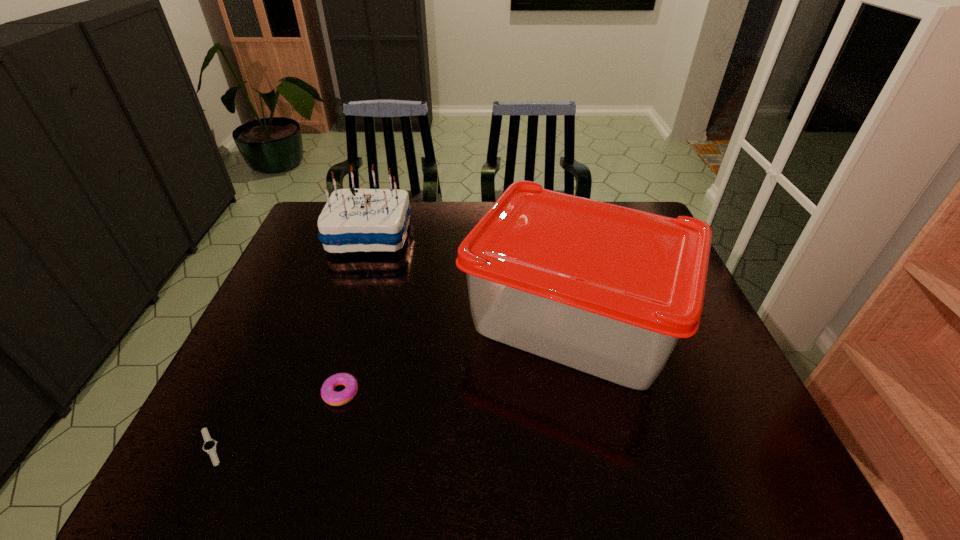
At what (x,y) coordinates should I click in order to perform the action: click on the rightmost object. Please return your answer as a coordinate pair (x, y). The height and width of the screenshot is (540, 960). Looking at the image, I should click on (608, 290).

I want to click on tray, so click(x=608, y=290).

Image resolution: width=960 pixels, height=540 pixels. Identify the location of the second tallest object. (353, 220).

You are a GUI agent. You are given a task and a screenshot of the screen. Output one action in this format:
    pyautogui.click(x=<x>, y=<y>)
    Task: Click on the doughnut
    This screenshot has width=960, height=540.
    Given the screenshot: What is the action you would take?
    pyautogui.click(x=331, y=397)

You are a GUI agent. You are given a task and a screenshot of the screen. Output one action in this format:
    pyautogui.click(x=<x>, y=<y>)
    Task: Click on the nearest object
    
    Given the screenshot: What is the action you would take?
    pyautogui.click(x=209, y=445)

The height and width of the screenshot is (540, 960). I want to click on watch, so click(209, 445).

Image resolution: width=960 pixels, height=540 pixels. Find the location of `vacant space located 0.380m on the left of the tallest object`. vacant space located 0.380m on the left of the tallest object is located at coordinates (319, 319).

The image size is (960, 540). I want to click on free point located 0.060m on the back of the birthday cake, so click(x=379, y=205).

In order to click on free location located on the back of the doughnut in this screenshot , I will do `click(354, 342)`.

This screenshot has height=540, width=960. I want to click on vacant point located on the back of the nearest object, so click(237, 393).